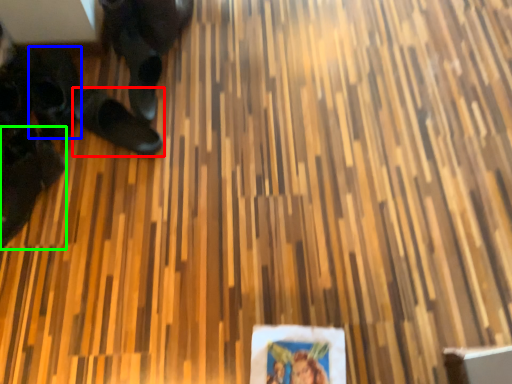
Question: Which object is the farthest from footwear (highlighted by a red box)? Choose among these: footwear (highlighted by a blue box) or footwear (highlighted by a green box).

Choices:
 (A) footwear
 (B) footwear

Answer: (B)